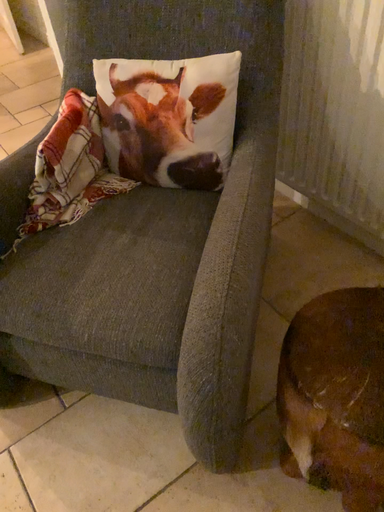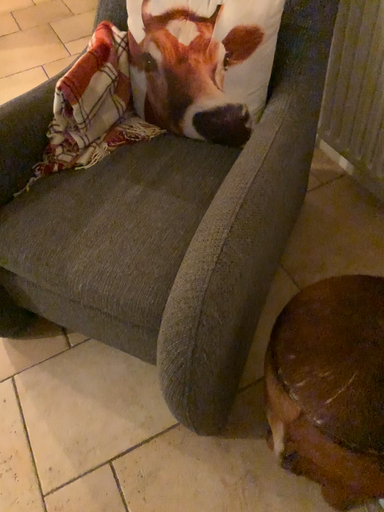
Question: How did the camera likely rotate when shooting the video?

Choices:
 (A) rotated upward
 (B) rotated downward

Answer: (B)